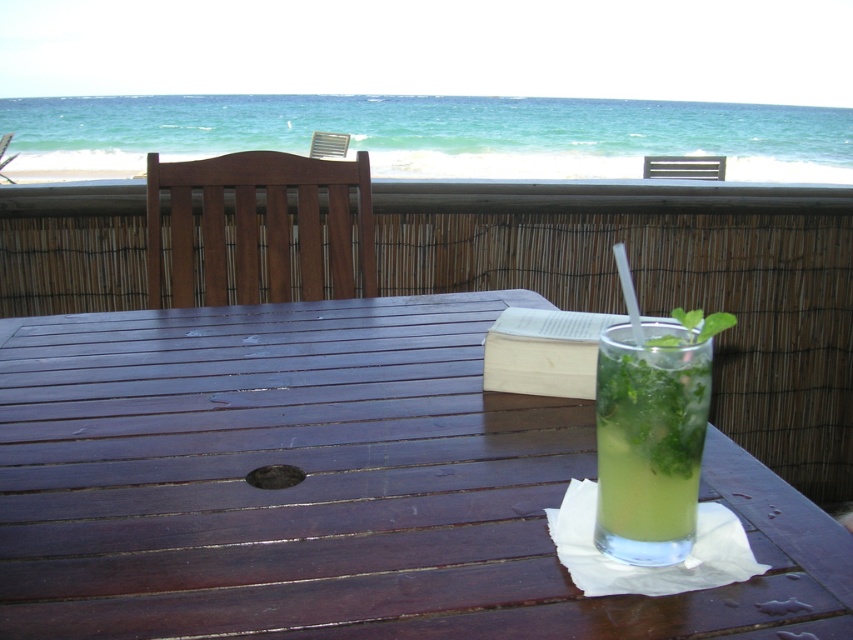
Question: Does wooden table at center appear on the right side of green leafy liquid at center?

Choices:
 (A) yes
 (B) no

Answer: (B)

Question: Is wooden table at center positioned in front of green leafy liquid at center?

Choices:
 (A) yes
 (B) no

Answer: (B)

Question: Is wooden table at center below green leafy liquid at center?

Choices:
 (A) no
 (B) yes

Answer: (B)

Question: Which of the following is the closest to the observer?

Choices:
 (A) wooden table at center
 (B) green leafy liquid at center

Answer: (B)

Question: Which object is closer to the camera taking this photo?

Choices:
 (A) wooden table at center
 (B) green leafy liquid at center

Answer: (B)